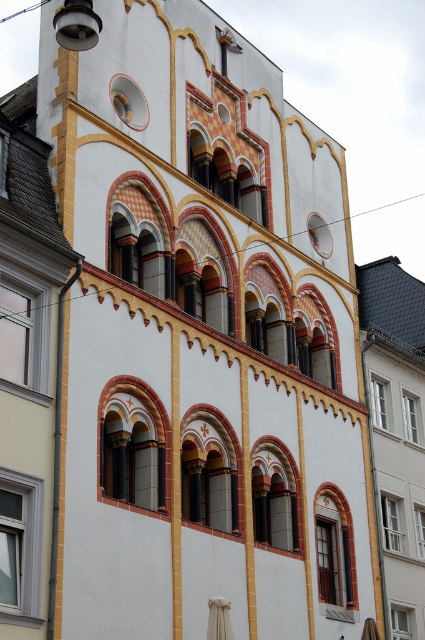
You are an architect examining the building. You notice two windows at the center of the building facade. Which one is closer to you, the matte yellow window at center or the matte white window at center?

The matte yellow window at center is closer to you because it is in front of the matte white window at center according to the description.

You are an architect designing a new building inspired by this one. You want to place a new window between the existing matte red glass window at center and the matte yellow window at center. Which existing window should the new window be closer to so that it maintains the symmetry of the building?

The new window should be closer to the matte red glass window at center because its width is smaller than the matte yellow window at center, so to maintain symmetry, the spacing between them should be adjusted accordingly.